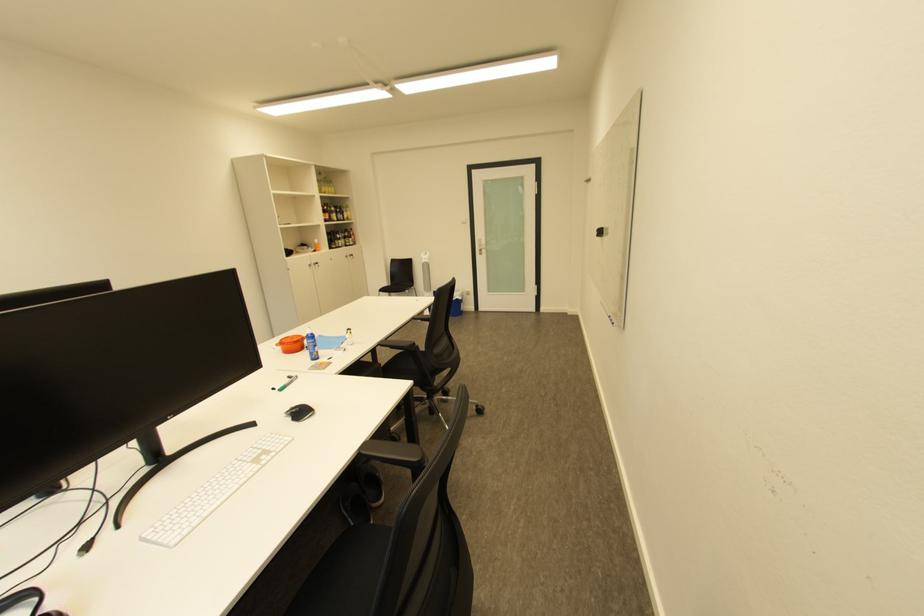
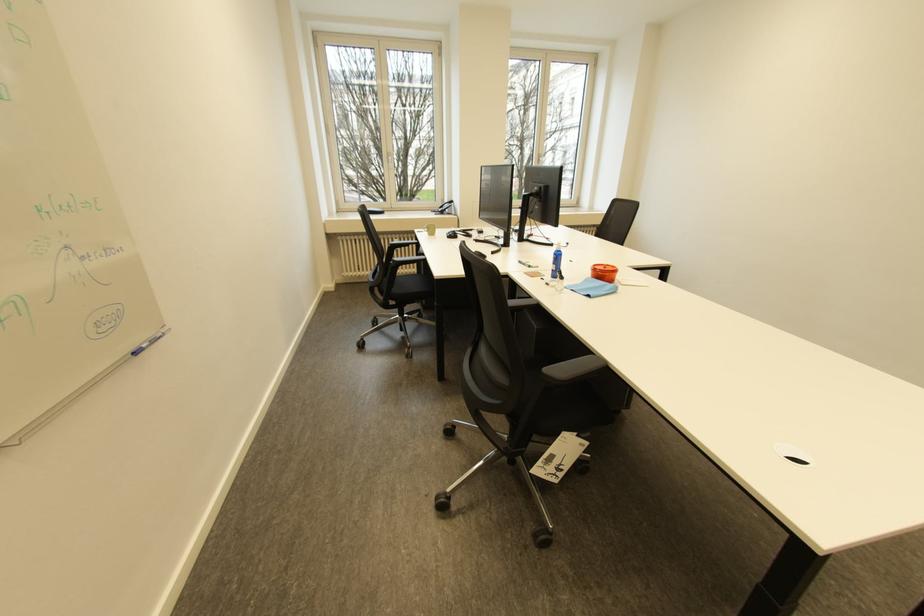
Question: I am providing you with two images of the same scene from different viewpoints. Please identify which objects are invisible in image2.

Choices:
 (A) wall-mounted button
 (B) chair armrest
 (C) phone handset
 (D) orange container

Answer: (B)